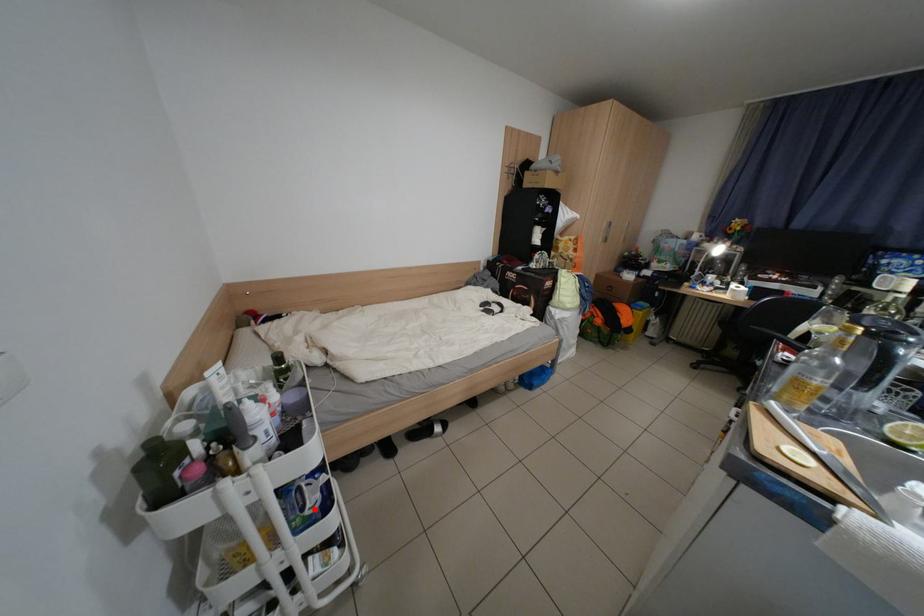
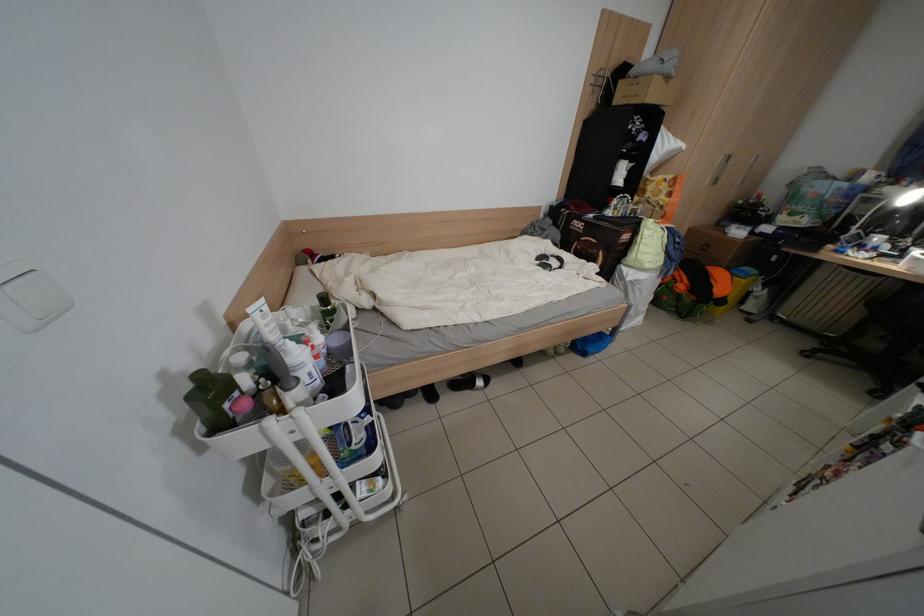
Question: I am providing you with two images of the same scene from different viewpoints. In image1, a red point is highlighted. Considering the same 3D point in image2, which of the following is correct?

Choices:
 (A) It is closer
 (B) It is farther

Answer: (A)